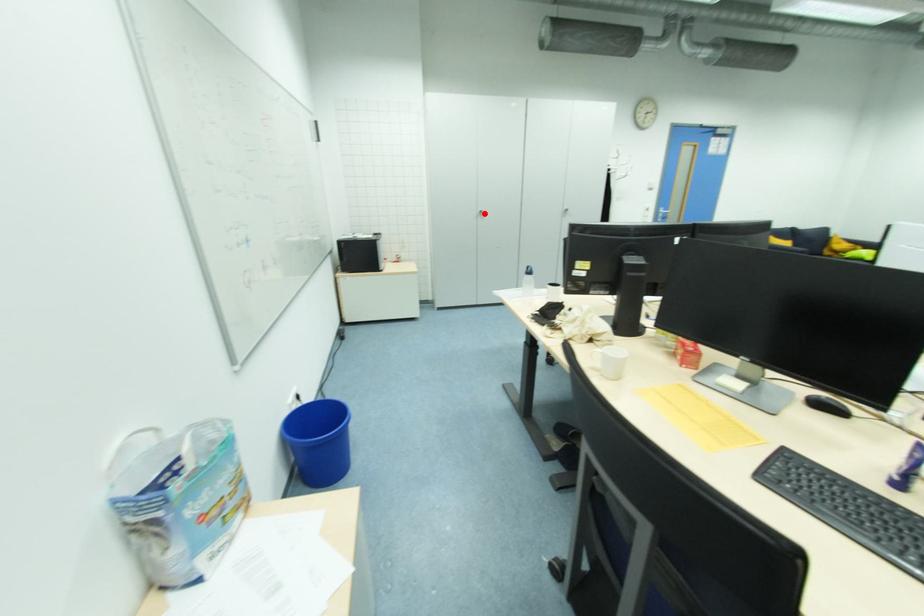
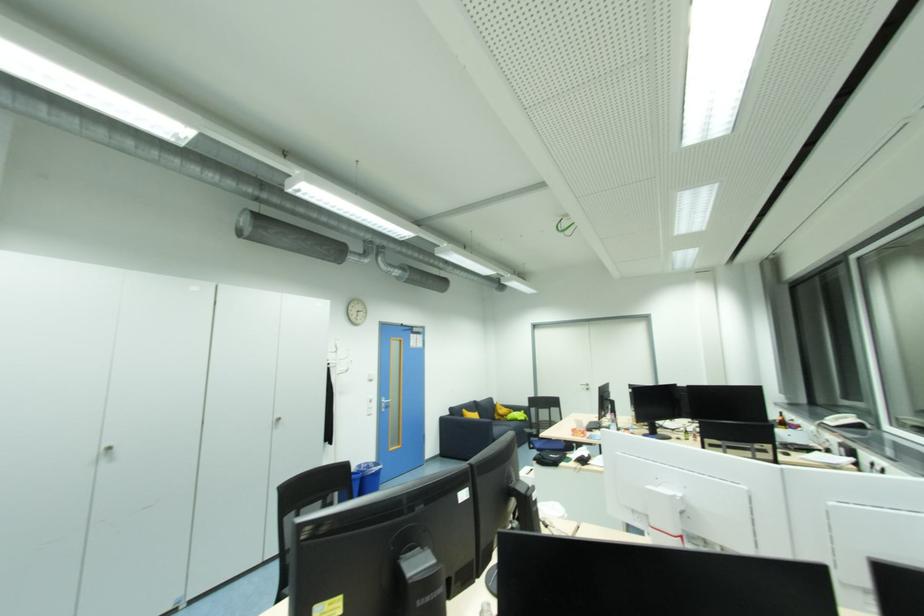
In the second image, find the point that corresponds to the highlighted location in the first image.

(113, 448)